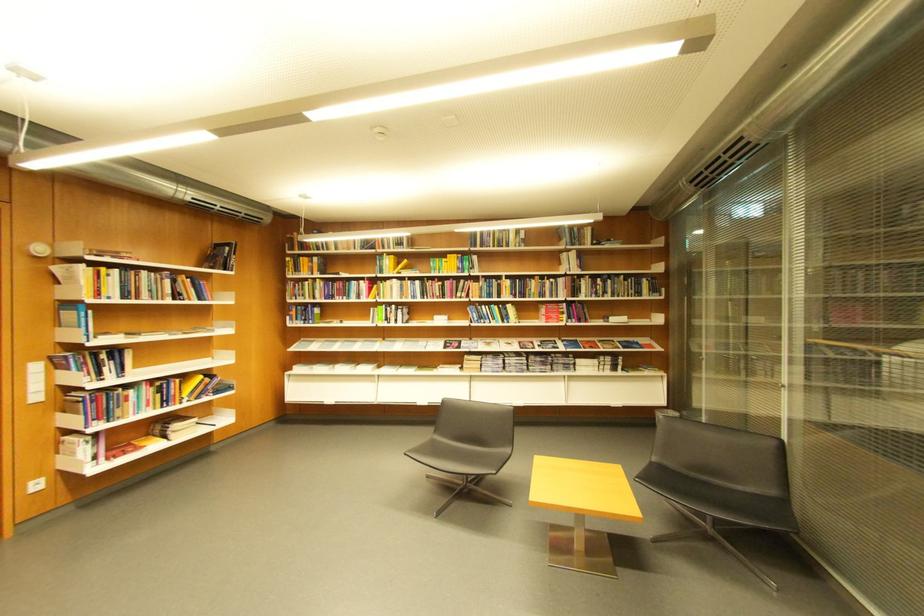
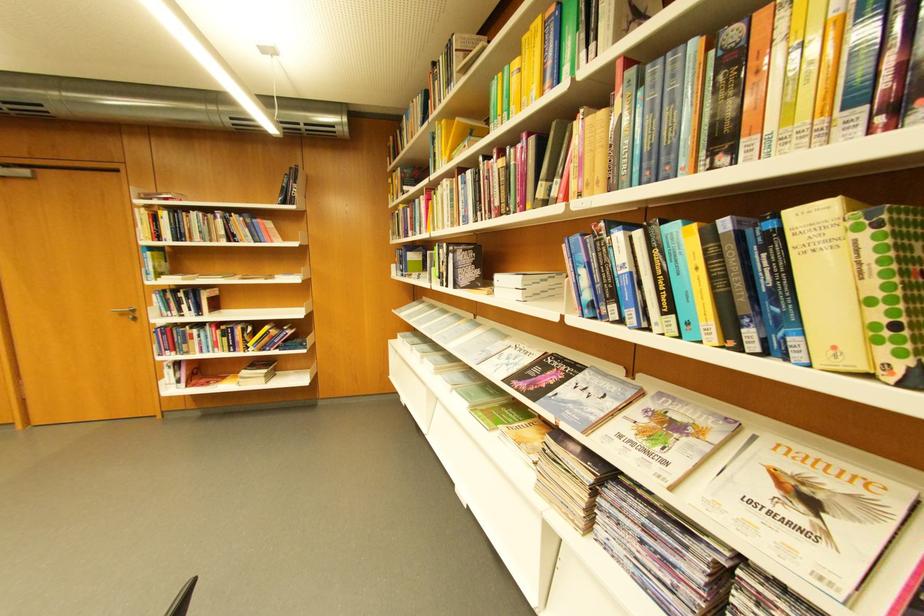
Locate, in the second image, the point that corresponds to (x=517, y=307) in the first image.

(796, 214)